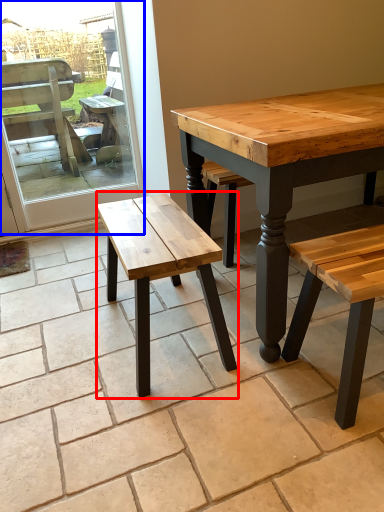
Question: Which point is closer to the camera, stool (highlighted by a red box) or screen door (highlighted by a blue box)?

Choices:
 (A) stool
 (B) screen door

Answer: (A)